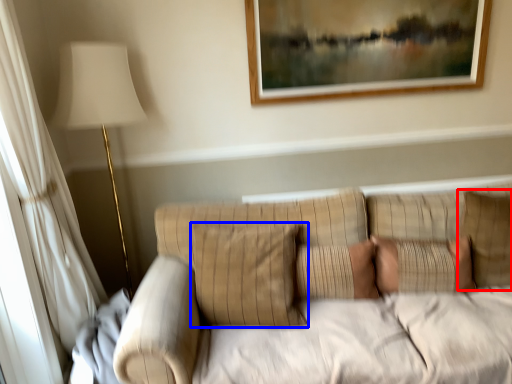
Question: Which of the following is the farthest to the observer, pillow (highlighted by a red box) or pillow (highlighted by a blue box)?

Choices:
 (A) pillow
 (B) pillow

Answer: (A)